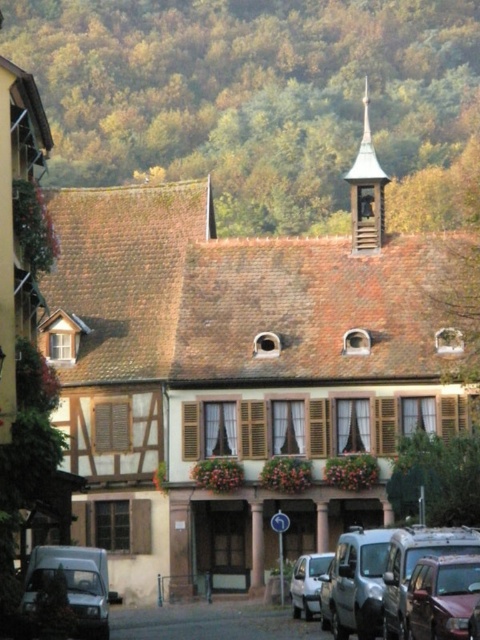
You are a tourist standing in front of the half timbered building and you see a metallic silver van at lower right and a metallic silver car at lower right. Which one is more to the left?

The metallic silver van at lower right is positioned on the left side of metallic silver car at lower right, so the metallic silver van at lower right is more to the left.

In the scene shown: You are standing at the center of the image and want to locate the metallic silver van at lower right. In which direction should you look to find it?

You should look to the lower right direction to find the metallic silver van at lower right, as its 2D location is at point (384, 572).

You are a delivery person who needs to park your vehicle in this area. You have a delivery van that is 20 feet long. The parking space here is between the metallic silver van at lower right and the white matte car at lower center. Can your van fit into this space?

The metallic silver van at lower right is 22.45 feet from the white matte car at lower center. Since your van is 20 feet long, it can fit into the parking space between them as the distance is sufficient.